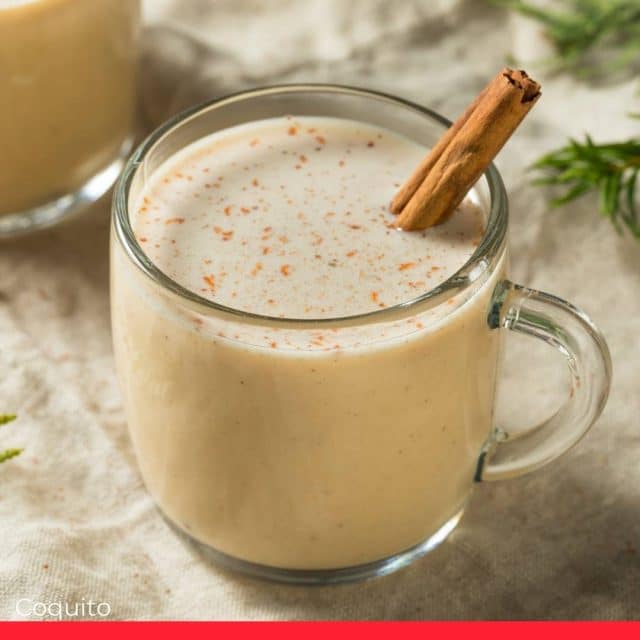
Identify the location of other cup. click(x=70, y=106).